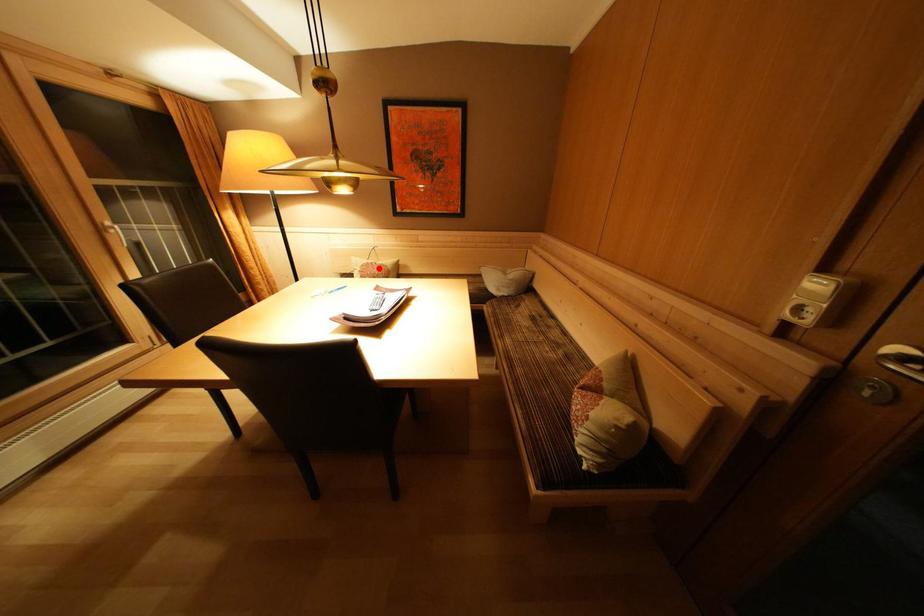
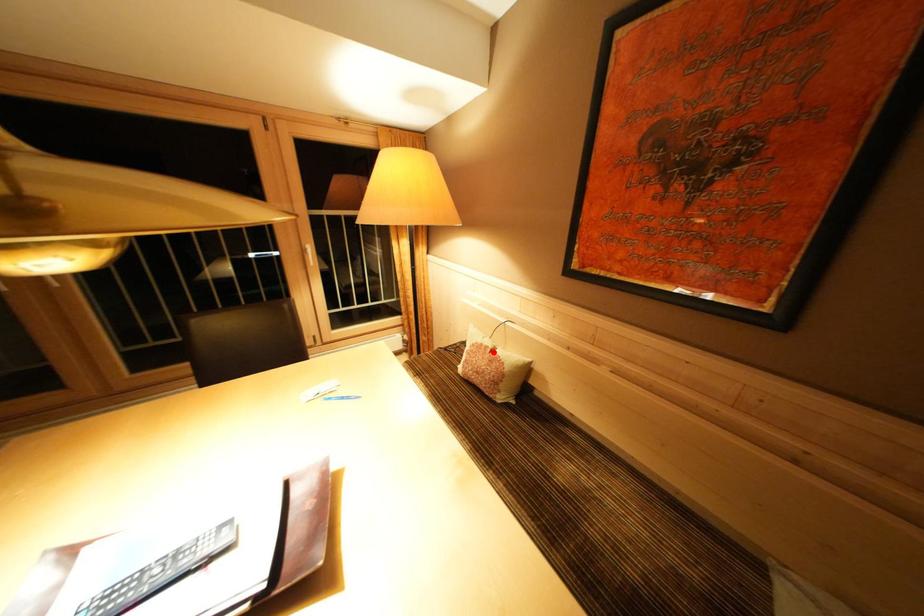
I am providing you with two images of the same scene from different viewpoints. A red point is marked on the first image and another point is marked on the second image. Do the highlighted points in image1 and image2 indicate the same real-world spot?

Yes